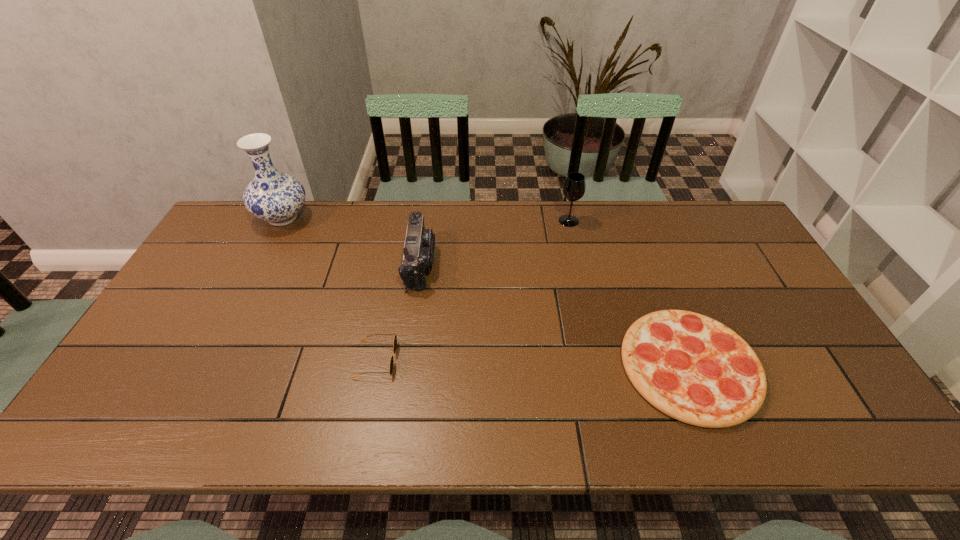
Locate an element on the screen. vase is located at coordinates (273, 196).

At what (x,y) coordinates should I click in order to perform the action: click on the leftmost object. Please return your answer as a coordinate pair (x, y). The width and height of the screenshot is (960, 540). Looking at the image, I should click on (273, 196).

At what (x,y) coordinates should I click in order to perform the action: click on wineglass. Please return your answer as a coordinate pair (x, y). The width and height of the screenshot is (960, 540). Looking at the image, I should click on (574, 187).

Where is `the second object from right to left`? This screenshot has height=540, width=960. the second object from right to left is located at coordinates pyautogui.click(x=574, y=187).

Image resolution: width=960 pixels, height=540 pixels. I want to click on camcorder, so click(418, 254).

Identify the location of the third farthest object. The image size is (960, 540). (418, 254).

Locate an element on the screen. This screenshot has width=960, height=540. the fourth tallest object is located at coordinates (395, 337).

At what (x,y) coordinates should I click in order to perform the action: click on the rightmost object. Please return your answer as a coordinate pair (x, y). Looking at the image, I should click on (691, 367).

Where is `the shortest object`? This screenshot has width=960, height=540. the shortest object is located at coordinates (691, 367).

Locate an element on the screen. The width and height of the screenshot is (960, 540). vacant space located on the front of the tallest object is located at coordinates (260, 262).